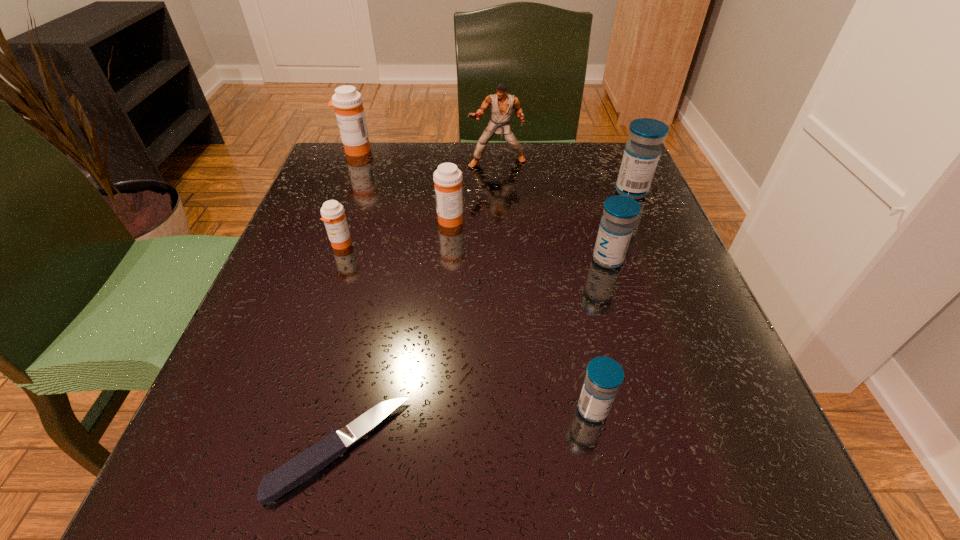
Where is `the smallest orange medicine`? This screenshot has width=960, height=540. the smallest orange medicine is located at coordinates (332, 212).

You are a GUI agent. You are given a task and a screenshot of the screen. Output one action in this format:
    pyautogui.click(x=<x>, y=<y>)
    Task: Click on the smallest blue medicine
    This screenshot has height=540, width=960.
    Given the screenshot: What is the action you would take?
    pyautogui.click(x=604, y=375)

I want to click on the third medicine from right to left, so click(604, 375).

In order to click on the shortest object in this screenshot , I will do `click(304, 466)`.

Find the location of a particular element. vacant space situated 0.070m on the front-facing side of the tallest object is located at coordinates (498, 188).

At what (x,y) coordinates should I click in order to perform the action: click on vacant position located 0.360m on the right of the farthest orange medicine. Please return your answer as a coordinate pair (x, y). Looking at the image, I should click on (518, 150).

What are the coordinates of `free location located on the front of the fifth nearest medicine` in the screenshot? It's located at (670, 282).

This screenshot has width=960, height=540. I want to click on free space located on the right of the fourth farthest object, so click(x=493, y=219).

I want to click on vacant space located on the back of the second object from right to left, so click(x=597, y=222).

At what (x,y) coordinates should I click in order to perform the action: click on free location located on the back of the nearest orange medicine. Please return your answer as a coordinate pair (x, y). This screenshot has height=540, width=960. Looking at the image, I should click on (354, 206).